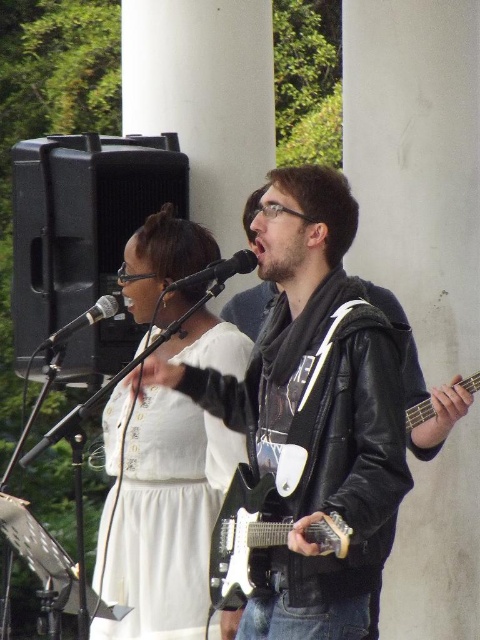
Question: Which of the following is the farthest from the observer?

Choices:
 (A) (210, 275)
 (B) (272, 497)
 (C) (151, 573)

Answer: (C)

Question: Can you confirm if black electric guitar at center is positioned above black metallic microphone at center?

Choices:
 (A) yes
 (B) no

Answer: (B)

Question: Estimate the real-world distances between objects in this image. Which object is closer to the white satin dress at center?

Choices:
 (A) black electric guitar at center
 (B) black matte microphone at center

Answer: (B)

Question: Where is white satin dress at center located in relation to black electric guitar at center in the image?

Choices:
 (A) left
 (B) right

Answer: (A)

Question: Is black electric guitar at center bigger than black metallic microphone at center?

Choices:
 (A) no
 (B) yes

Answer: (B)

Question: Which of the following is the farthest from the observer?

Choices:
 (A) (167, 525)
 (B) (282, 500)
 (C) (117, 294)
 (D) (232, 268)

Answer: (C)